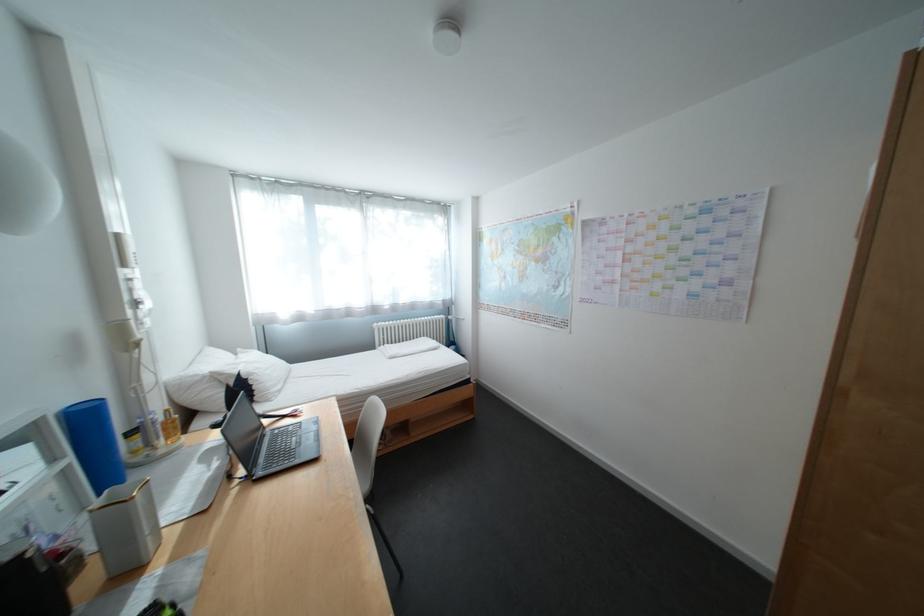
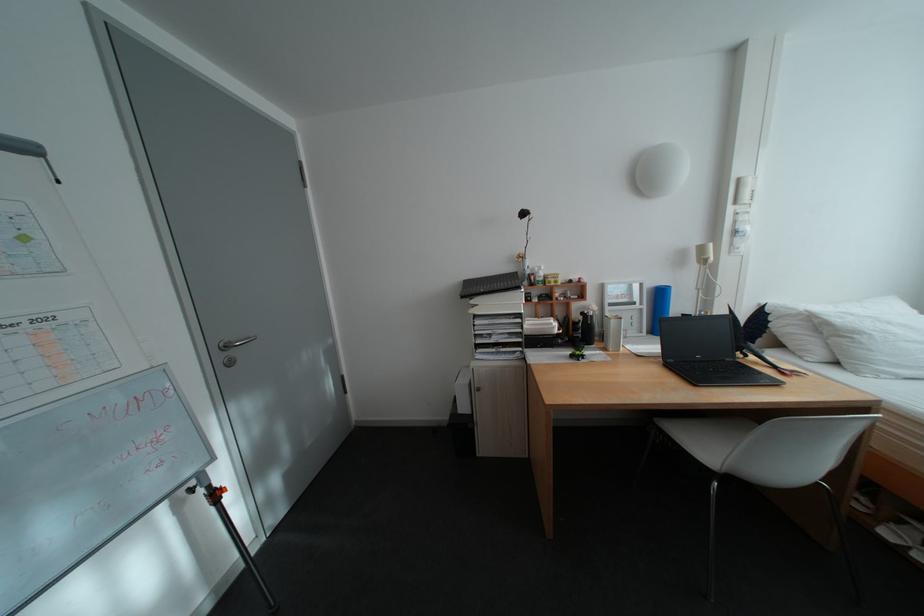
Find the pixel in the second image that matches point (264, 376) in the first image.

(871, 334)